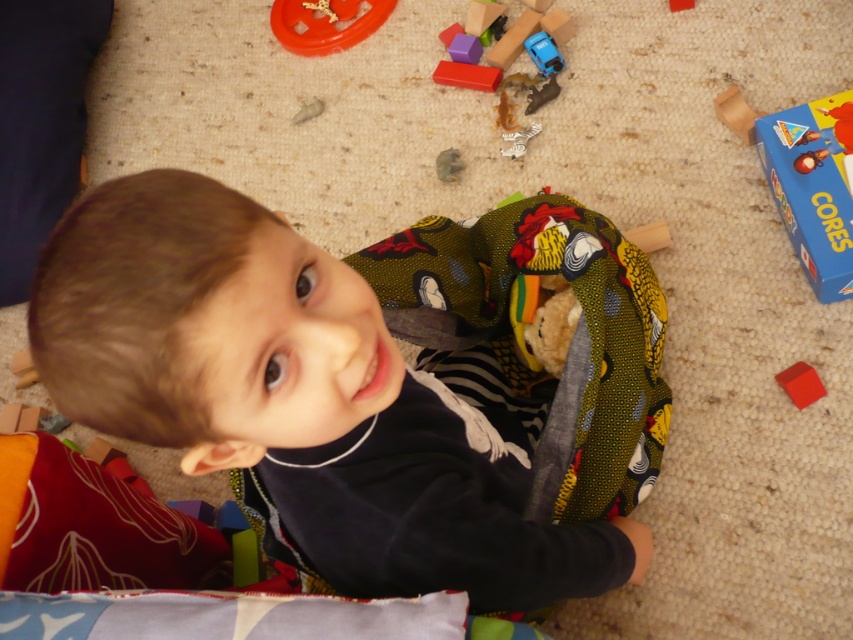
Does smooth skin child at center have a larger size compared to smooth red block at upper center?

Yes.

Measure the distance between smooth skin child at center and camera.

19.08 inches

The image size is (853, 640). I want to click on smooth skin child at center, so click(312, 401).

Does point (276, 476) lie behind point (543, 33)?

No, it is not.

Who is taller, smooth skin child at center or metallic blue car at center?

smooth skin child at center

Between point (49, 385) and point (552, 54), which one is positioned behind?

The point (552, 54) is more distant.

Image resolution: width=853 pixels, height=640 pixels. I want to click on smooth skin child at center, so click(x=312, y=401).

Who is positioned more to the right, smooth orange ring at upper center or wooden blocks at upper center?

wooden blocks at upper center

Which is behind, point (395, 1) or point (476, 68)?

The point (395, 1) is more distant.

Find the location of a particular element. The height and width of the screenshot is (640, 853). smooth orange ring at upper center is located at coordinates [x=325, y=22].